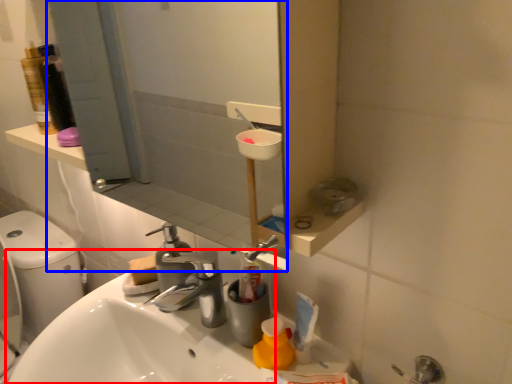
Question: Among these objects, which one is farthest to the camera, sink (highlighted by a red box) or mirror (highlighted by a blue box)?

Choices:
 (A) sink
 (B) mirror

Answer: (A)